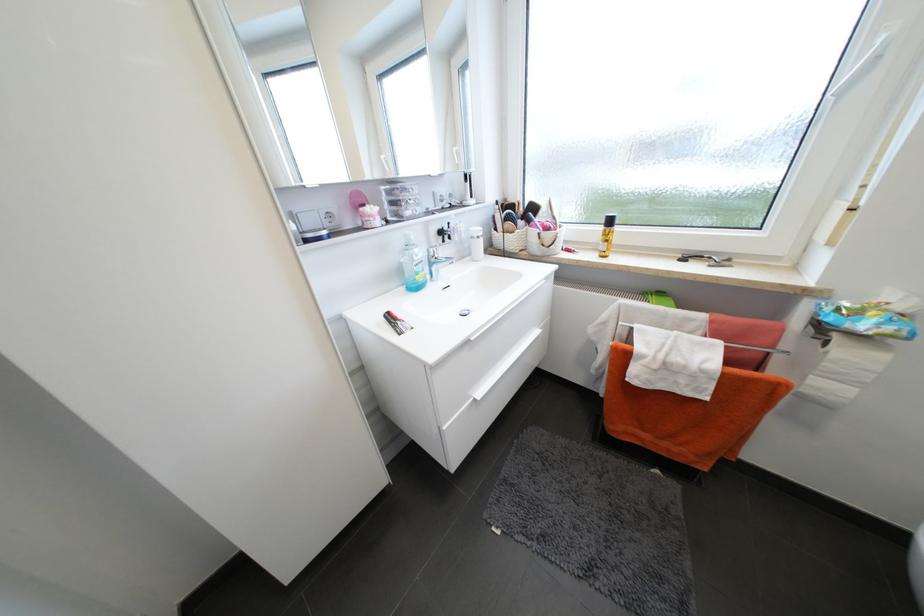
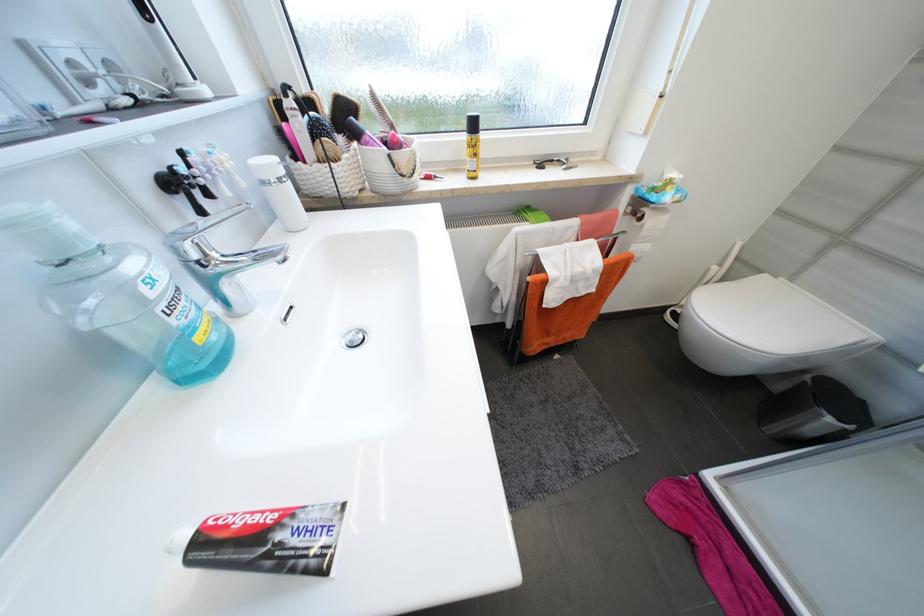
The point at (423,278) is marked in the first image. Where is the corresponding point in the second image?

(203, 339)